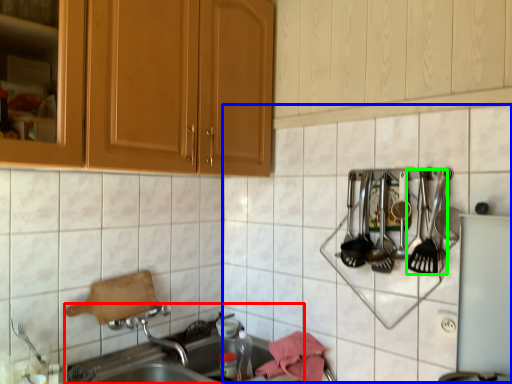
Question: Estimate the real-world distances between objects in this image. Which object is farther from sink (highlighted by a red box), tile (highlighted by a blue box) or silverware (highlighted by a green box)?

Choices:
 (A) tile
 (B) silverware

Answer: (B)